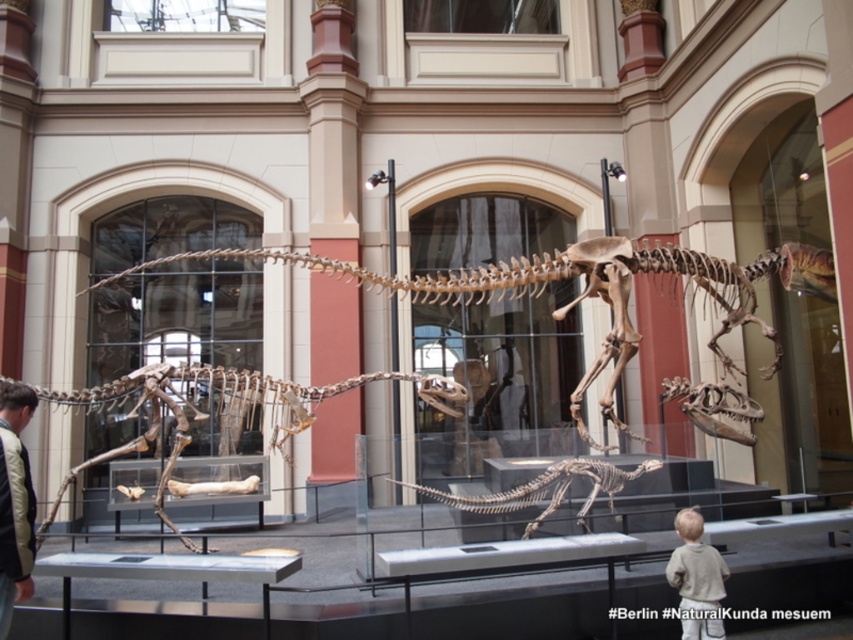
Question: Does khaki fabric jacket at left come in front of light gray sweater at lower right?

Choices:
 (A) yes
 (B) no

Answer: (A)

Question: Can you confirm if khaki fabric jacket at left is positioned to the right of light gray sweater at lower right?

Choices:
 (A) yes
 (B) no

Answer: (B)

Question: Among these objects, which one is nearest to the camera?

Choices:
 (A) brown bone dinosaur at center
 (B) khaki fabric jacket at left
 (C) brown bone-like skeleton at center

Answer: (B)

Question: Which object is positioned farthest from the brown bone dinosaur at center?

Choices:
 (A) khaki fabric jacket at left
 (B) brown bone-like skeleton at center

Answer: (A)

Question: Which point is closer to the camera taking this photo?

Choices:
 (A) (585, 502)
 (B) (260, 384)
 (C) (691, 540)
 (D) (22, 392)

Answer: (D)

Question: Can you confirm if brown bone dinosaur at center is thinner than khaki fabric jacket at left?

Choices:
 (A) yes
 (B) no

Answer: (B)